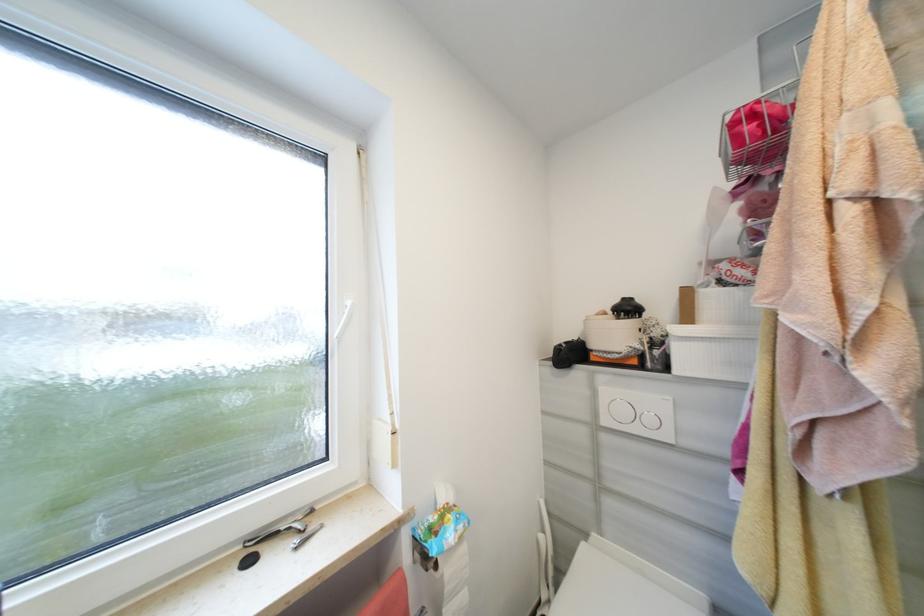
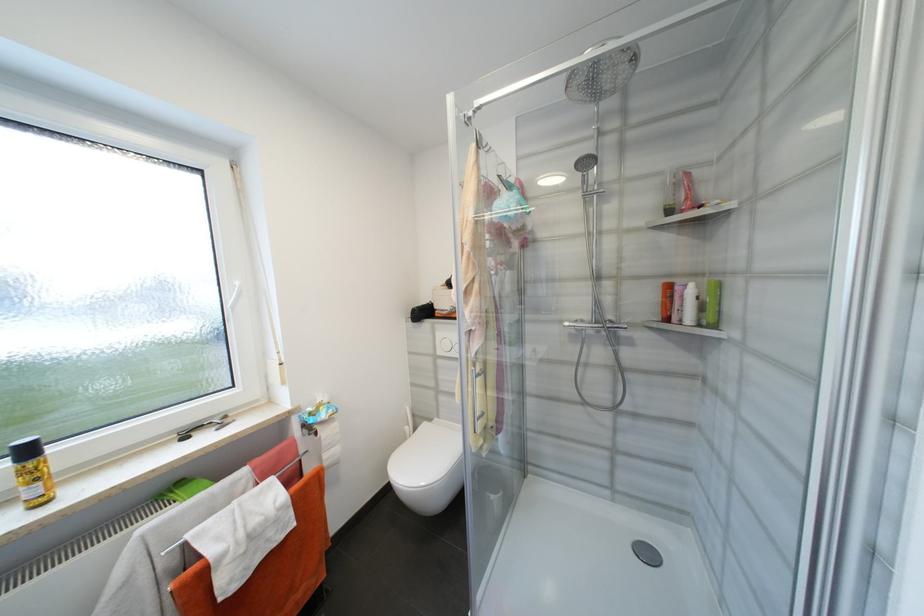
Where in the second image is the point corresponding to (591,418) from the first image?

(436, 352)